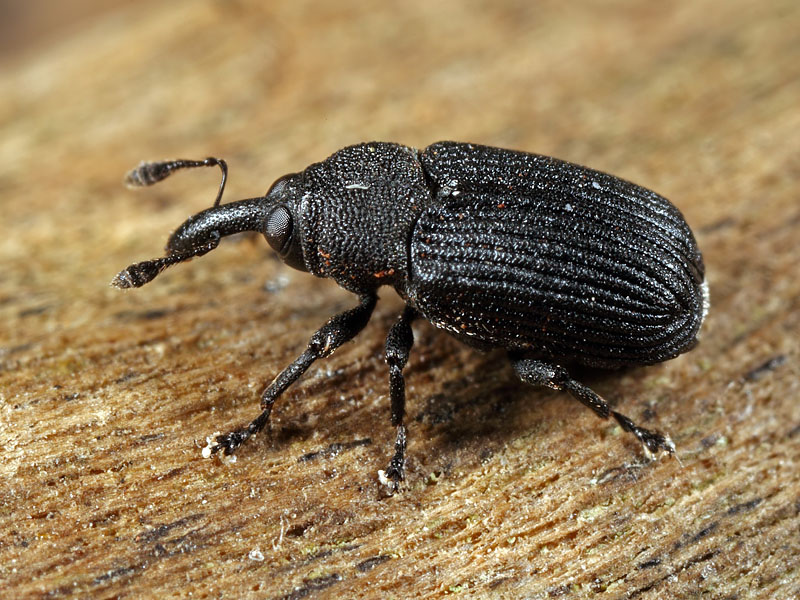
At what (x,y) coordinates should I click in order to perform the action: click on wood surface. Please return your answer as a coordinate pair (x, y). Looking at the image, I should click on (634, 480).